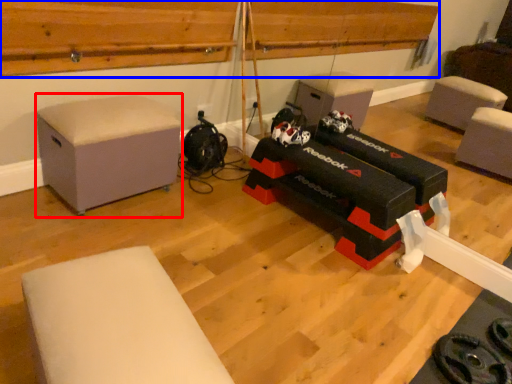
Question: Which of the following is the farthest to the observer, furniture (highlighted by a red box) or wood (highlighted by a blue box)?

Choices:
 (A) furniture
 (B) wood

Answer: (A)